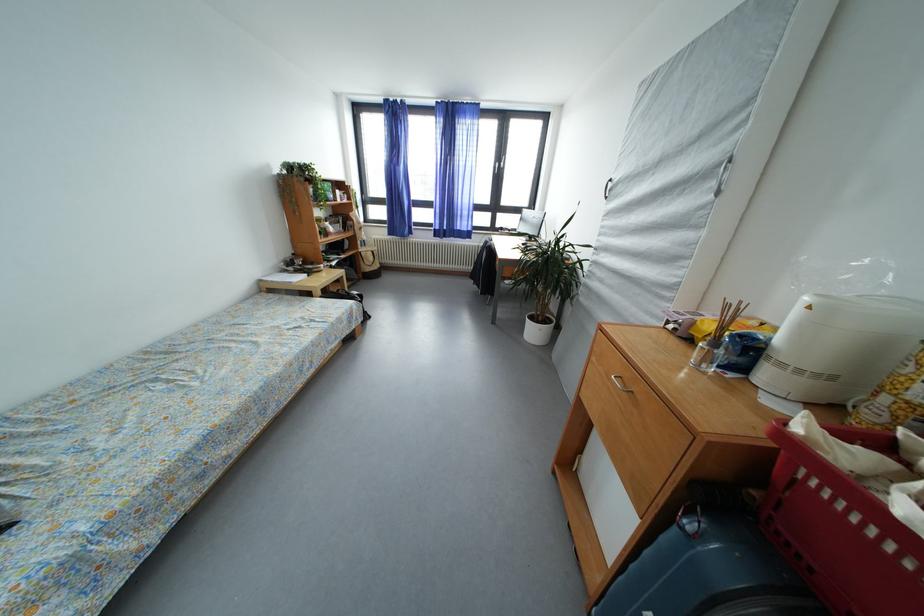
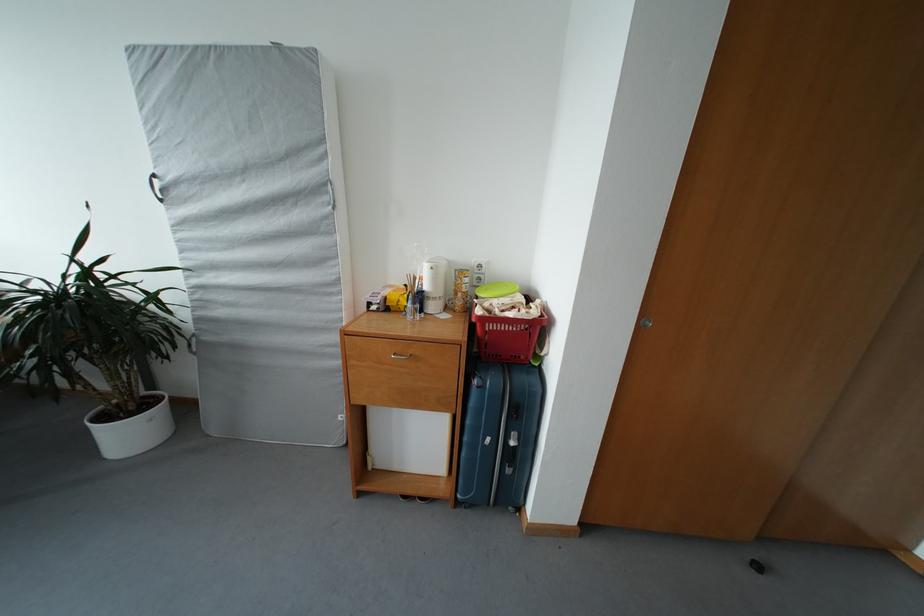
The images are taken continuously from a first-person perspective. In which direction is your viewpoint rotating?

The rotation direction of the camera is right-down.